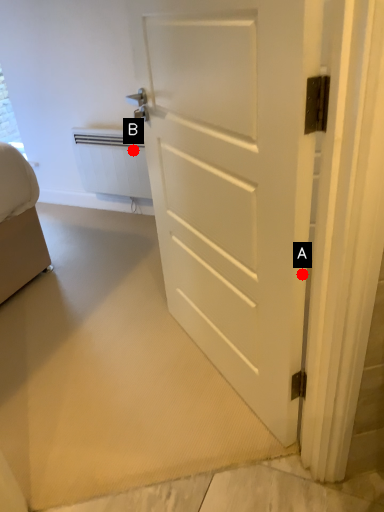
Question: Two points are circled on the image, labeled by A and B beside each circle. Which point appears farthest from the camera in this image?

Choices:
 (A) A is further
 (B) B is further

Answer: (B)